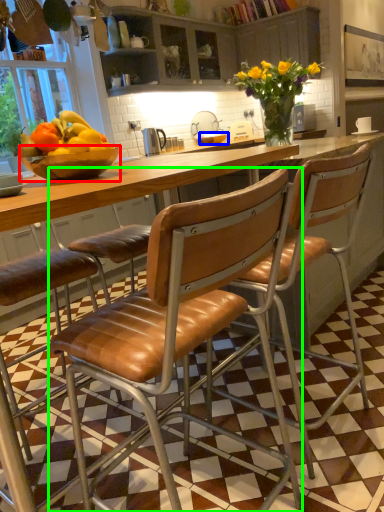
Question: Considering the real-world distances, which object is farthest from bowl (highlighted by a red box)? bowl (highlighted by a blue box) or chair (highlighted by a green box)?

Choices:
 (A) bowl
 (B) chair

Answer: (A)